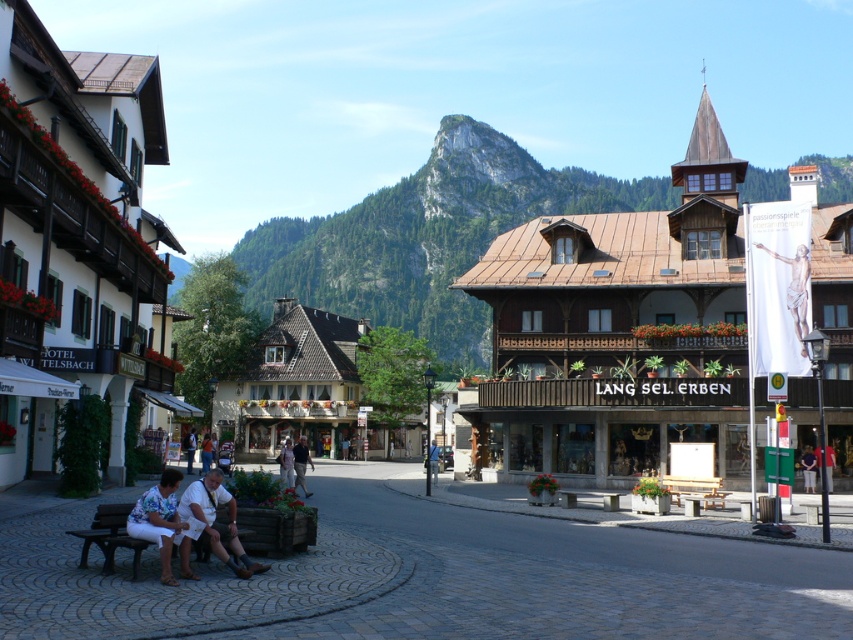
You are standing in the quaint European town and want to take a photo of both the point at coordinates point (132, 573) and the point at coordinates point (677, 499). Which point should you focus on first to ensure both are in clear view?

You should focus on point (132, 573) first because it is closer to the camera than point (677, 499), ensuring both points are in clear view.

You are a tourist standing at the entrance of the Hotel WITTELSBACH and want to meet someone wearing a light brown leather jacket at center. Based on the scene description, where should you look to find this person?

The light brown leather jacket at center is located at the coordinates point (286, 464) in the scene, so you should look towards the center of the image where those coordinates are.

Based on the photo, you are a tourist standing at the entrance of the town square. You see a wooden bench at center and dark gray pants at center. Which object is positioned higher from the ground?

The wooden bench at center is located above dark gray pants at center, so the wooden bench at center is higher from the ground.